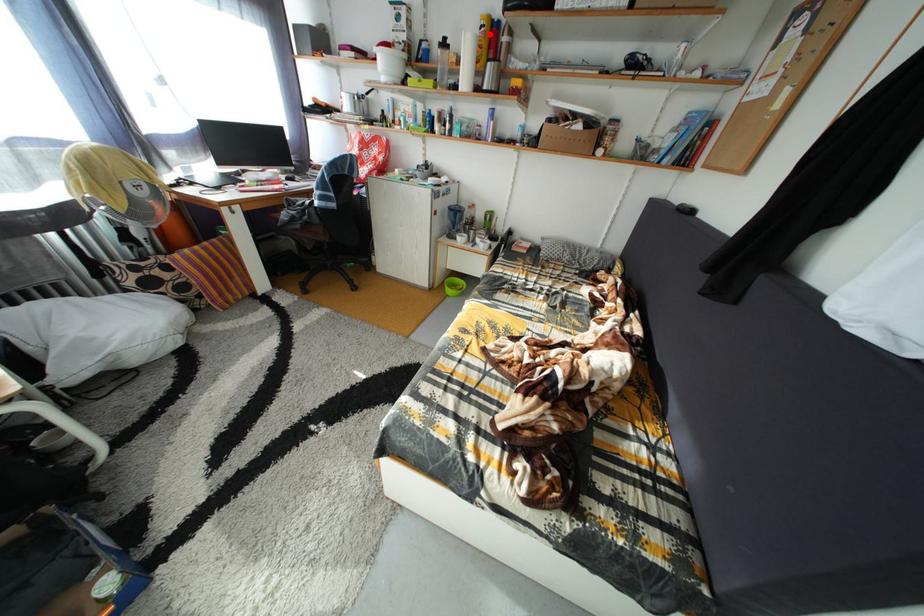
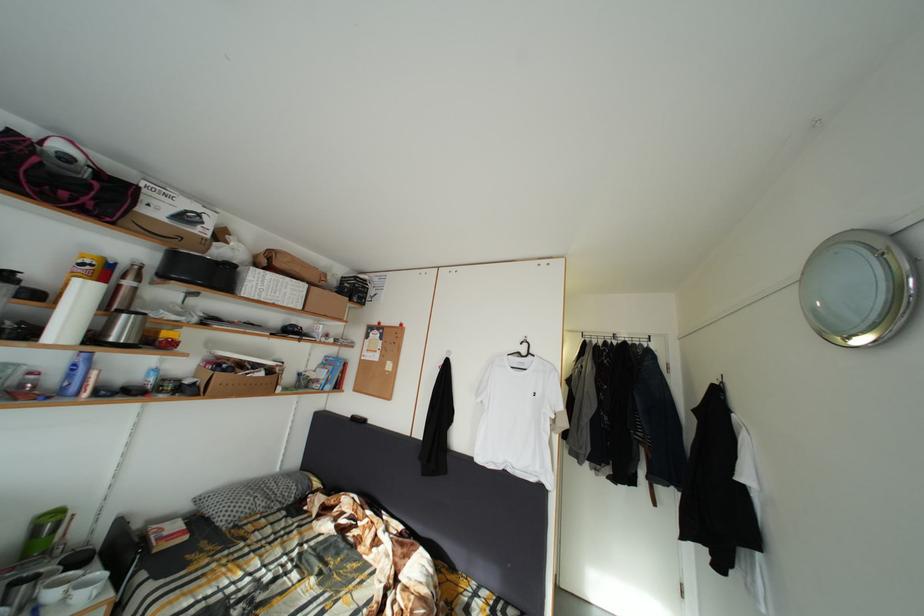
In the second image, find the point that corresponds to the highlighted location in the first image.

(91, 270)